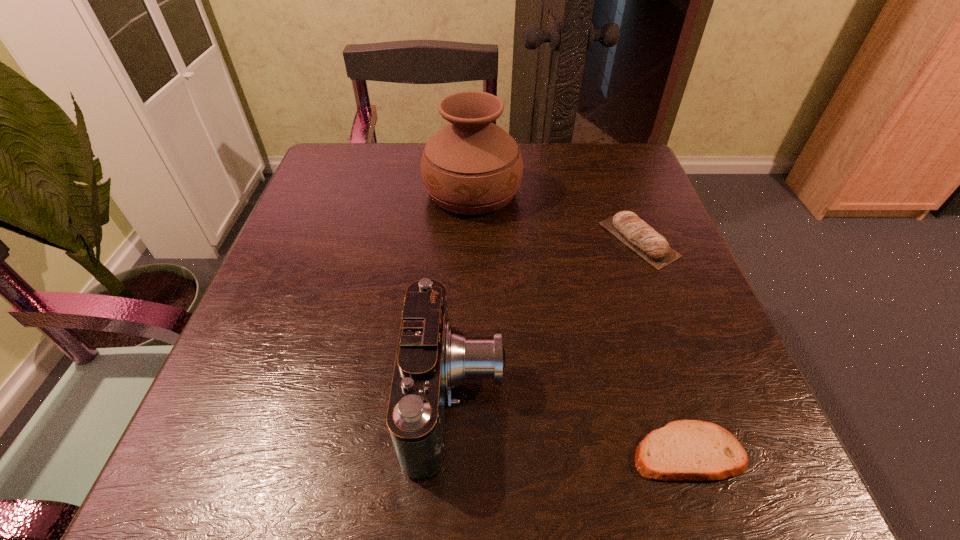
Where is `object positioned at the far edge`? This screenshot has height=540, width=960. object positioned at the far edge is located at coordinates (471, 166).

Find the location of a particular element. The height and width of the screenshot is (540, 960). camcorder situated at the near edge is located at coordinates (432, 358).

At what (x,y) coordinates should I click in order to perform the action: click on pita bread located at the near edge. Please return your answer as a coordinate pair (x, y). This screenshot has width=960, height=540. Looking at the image, I should click on (685, 450).

Locate an element on the screen. object located at the near right corner is located at coordinates (685, 450).

The height and width of the screenshot is (540, 960). I want to click on vacant area at the far edge of the desktop, so click(396, 144).

In the image, there is a desktop. In order to click on vacant area at the near edge in this screenshot , I will do `click(555, 489)`.

The width and height of the screenshot is (960, 540). I want to click on free point at the left edge, so click(306, 248).

The height and width of the screenshot is (540, 960). Find the location of `free space at the right edge of the desktop`. free space at the right edge of the desktop is located at coordinates (602, 239).

Find the location of `free space at the far left corner of the desktop`. free space at the far left corner of the desktop is located at coordinates (319, 179).

The width and height of the screenshot is (960, 540). What are the coordinates of `vacant area at the near left corner` in the screenshot? It's located at (219, 442).